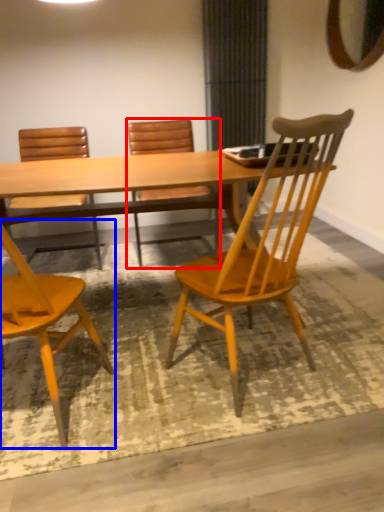
Question: Which of the following is the farthest to the observer, chair (highlighted by a red box) or chair (highlighted by a blue box)?

Choices:
 (A) chair
 (B) chair

Answer: (A)